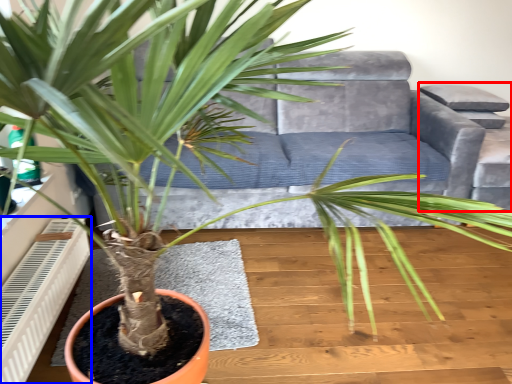
Question: Which object appears closest to the camera in this image, armchair (highlighted by a red box) or air conditioner (highlighted by a blue box)?

Choices:
 (A) armchair
 (B) air conditioner

Answer: (B)